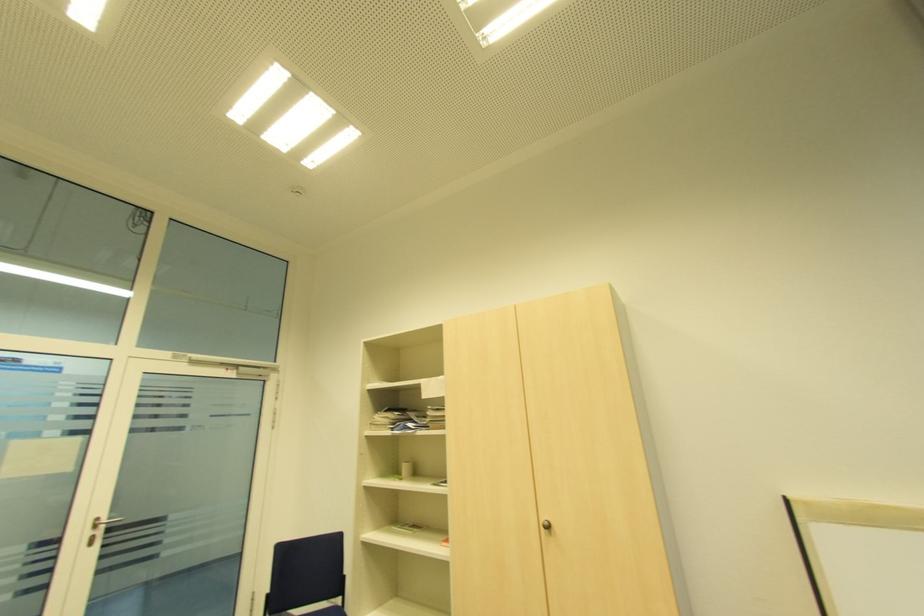
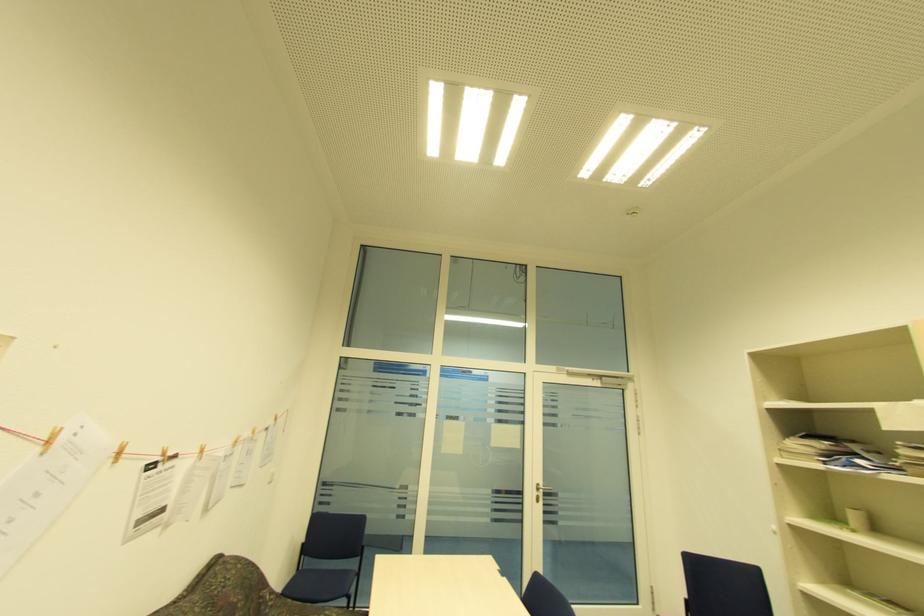
Question: The camera is either moving clockwise (left) or counter-clockwise (right) around the object. The first image is from the beginning of the video and the second image is from the end. Is the camera moving left or right when shooting the video?

Choices:
 (A) Left
 (B) Right

Answer: (B)